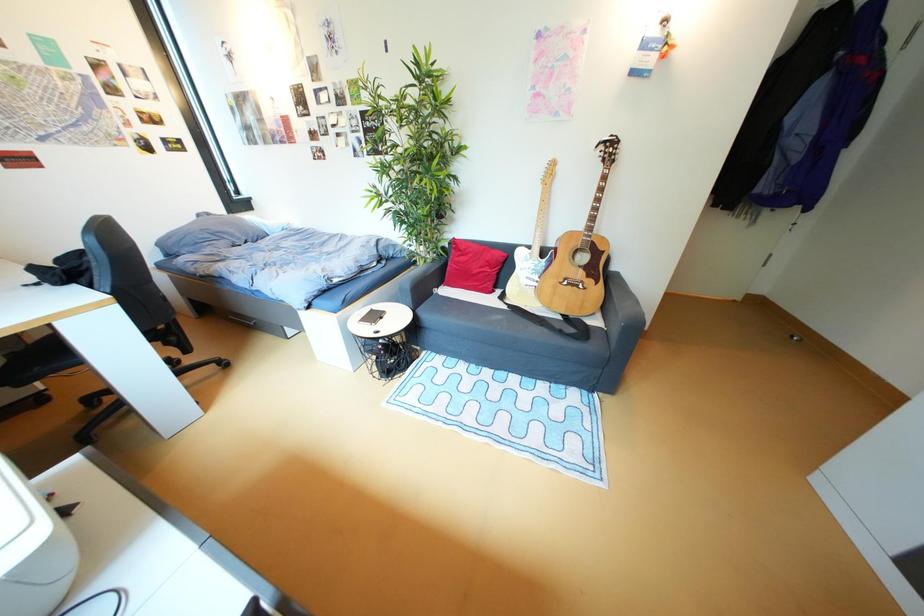
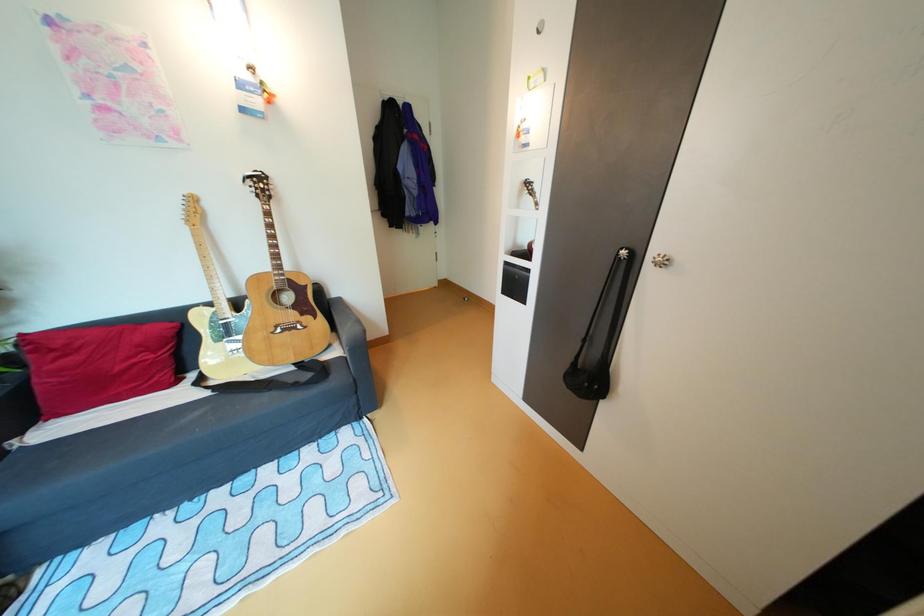
Question: Based on the continuous images, in which direction is the camera rotating? Reply with the corresponding letter.

Choices:
 (A) Left
 (B) Right
 (C) Up
 (D) Down

Answer: (B)